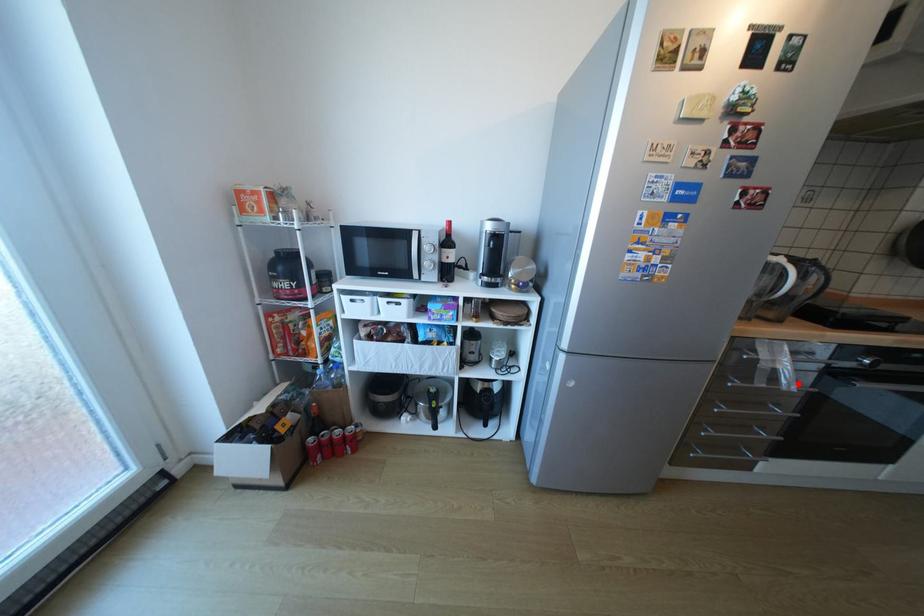
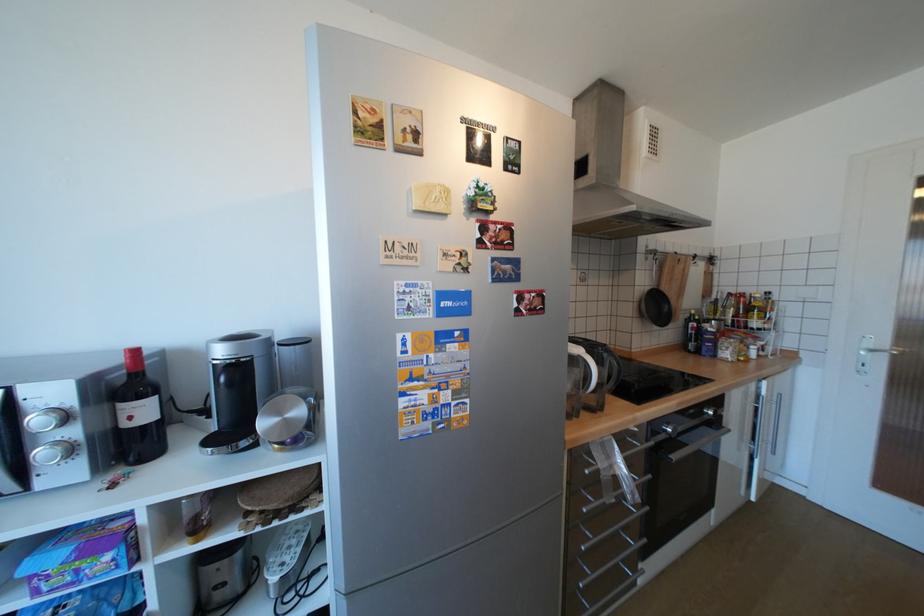
Locate, in the second image, the point that corresponds to the highlighted location in the first image.

(641, 493)